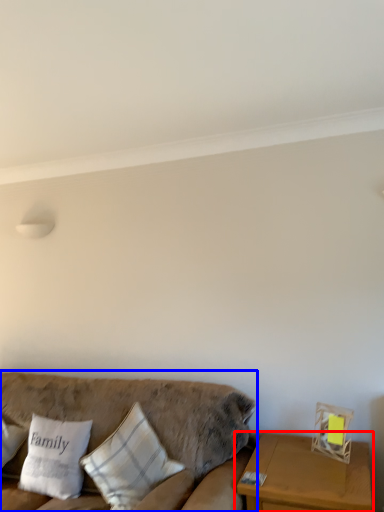
Question: Among these objects, which one is nearest to the camera, table (highlighted by a red box) or studio couch (highlighted by a blue box)?

Choices:
 (A) table
 (B) studio couch

Answer: (B)